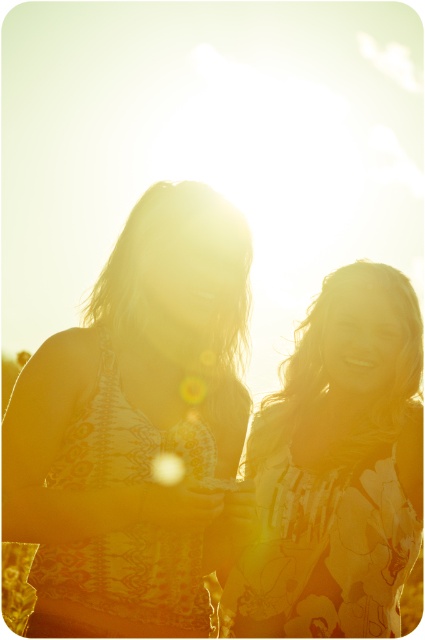
You are a photographer trying to adjust the lighting for a photo shoot. You have a matte yellow dress at left in your frame. Where should you position the dress to avoid the sun flare? Use the coordinate system where the bottom left corner is the origin.

The matte yellow dress at left is currently at coordinate point (136,428). To avoid the sun flare, move it to a position away from the sun source, which is behind the subjects. Since the sun is behind them, positioning the dress towards the front or adjusting the angle would help reduce the flare.